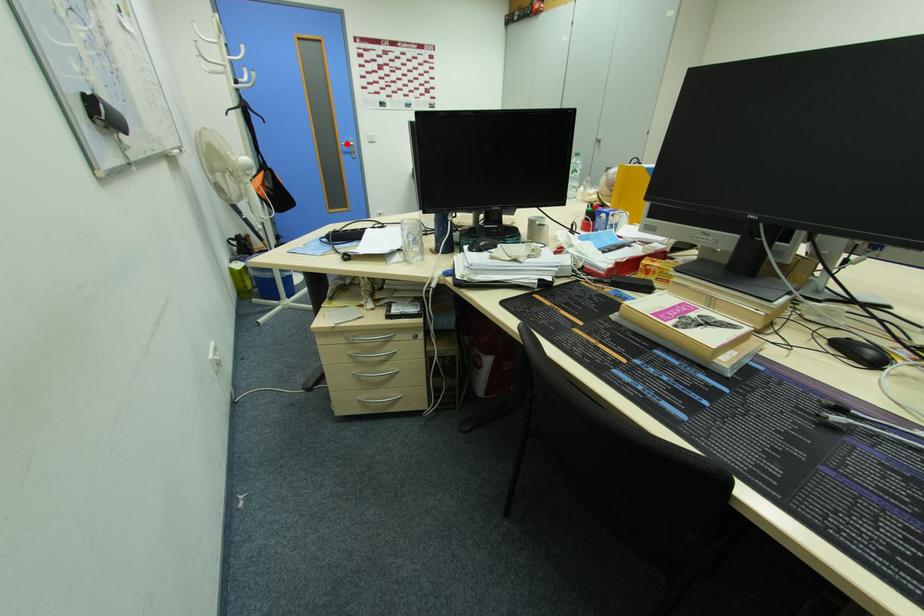
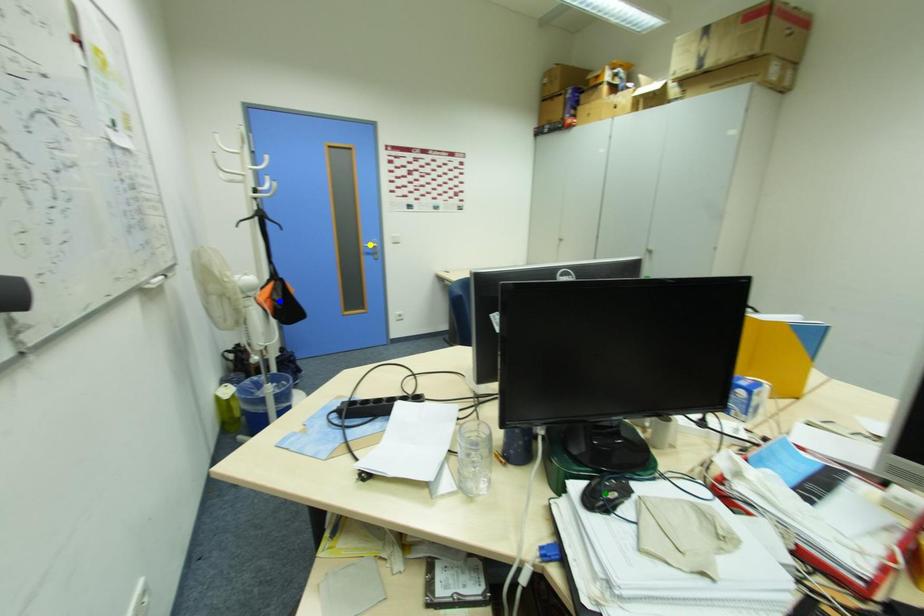
Question: I am providing you with two images of the same scene from different viewpoints. A red point is marked on the first image. You are given multiple points on the second image. In image 2, which mark is for the same physical point as the one in image 1?

Choices:
 (A) yellow point
 (B) blue point
 (C) green point

Answer: (A)